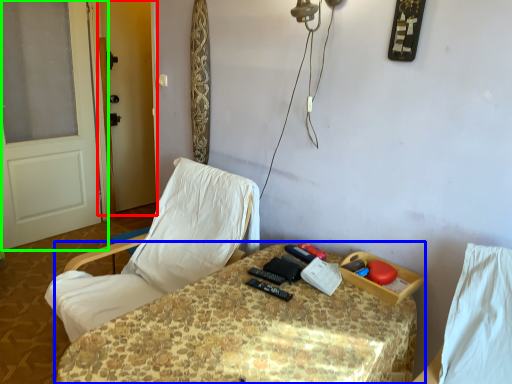
Question: Estimate the real-world distances between objects in this image. Which object is farther from screen door (highlighted by a red box), table (highlighted by a blue box) or door (highlighted by a green box)?

Choices:
 (A) table
 (B) door

Answer: (A)